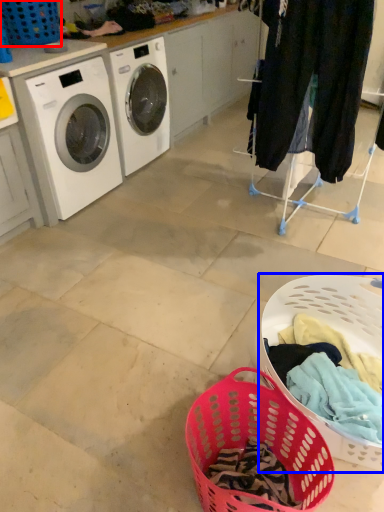
Question: Which point is further to the camera, basket (highlighted by a red box) or basket (highlighted by a blue box)?

Choices:
 (A) basket
 (B) basket

Answer: (A)